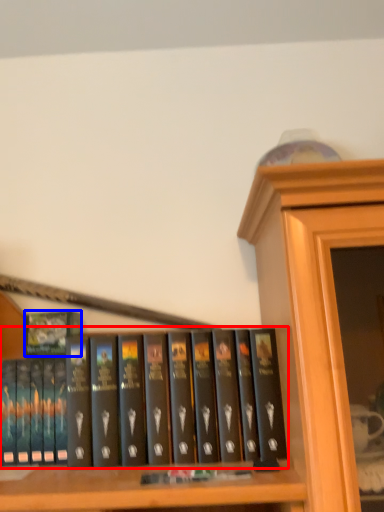
Question: Among these objects, which one is farthest to the camera, book (highlighted by a red box) or book cover (highlighted by a blue box)?

Choices:
 (A) book
 (B) book cover

Answer: (B)